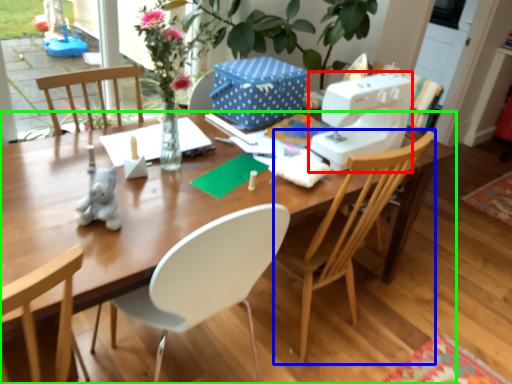
Question: Which object is positioned farthest from sewing machine (highlighted by a red box)? Select from chair (highlighted by a blue box) and desk (highlighted by a green box).

Choices:
 (A) chair
 (B) desk

Answer: (B)